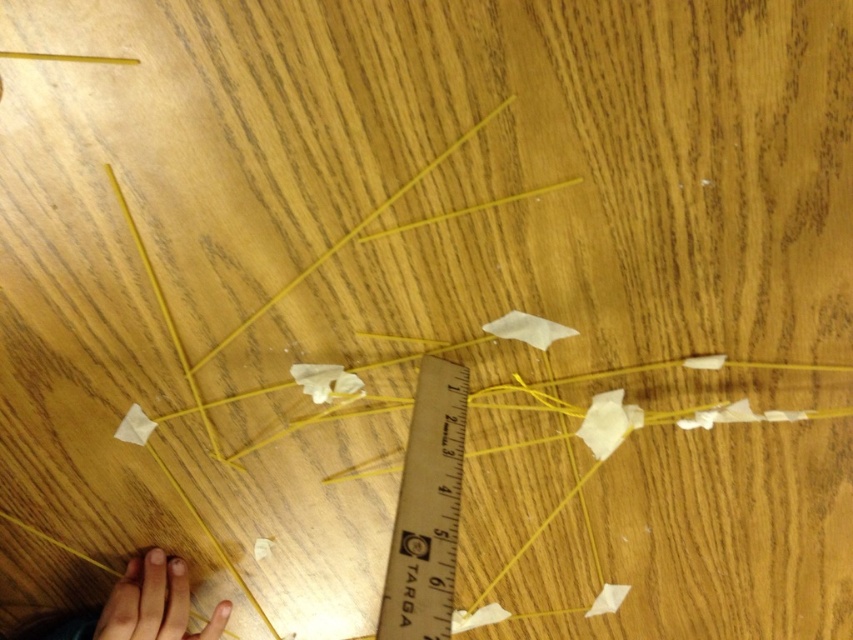
You are looking at the wooden surface with yellow spaghetti sticks arranged in a geometric pattern. There are two points marked on the image at coordinates point (407,493) and point (115,593). From your perspective, which of these two points appears closer to you?

Point (407,493) is closer to the camera than point (115,593), so from your perspective, point (407,493) appears closer to you.